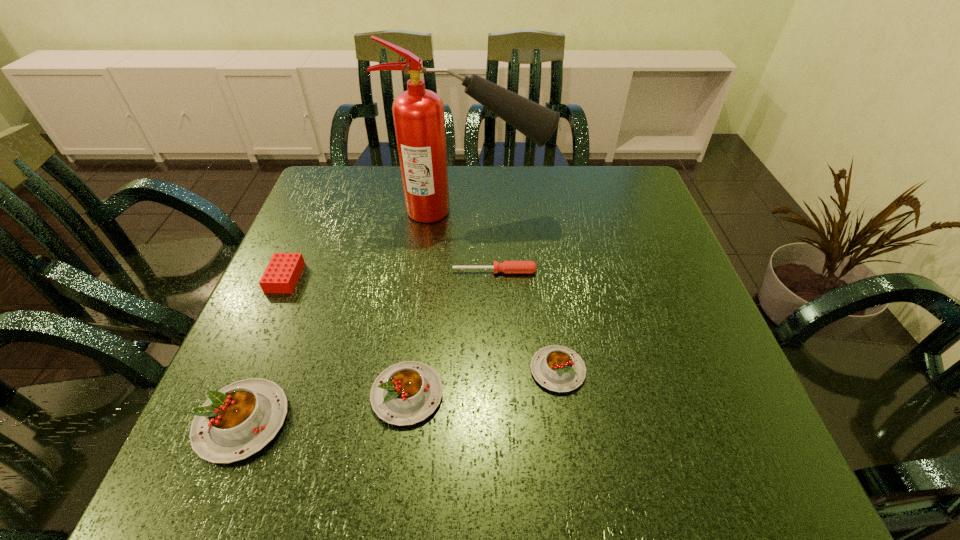
Image resolution: width=960 pixels, height=540 pixels. In the image, there is a desktop. Identify the location of vacant space at the near edge. (325, 417).

The height and width of the screenshot is (540, 960). In order to click on blank space at the left edge of the desktop in this screenshot , I will do [275, 301].

Image resolution: width=960 pixels, height=540 pixels. In the image, there is a desktop. What are the coordinates of `free region at the right edge` in the screenshot? It's located at (629, 255).

In the image, there is a desktop. In order to click on vacant space at the far left corner in this screenshot , I will do `click(362, 167)`.

Locate an element on the screen. The height and width of the screenshot is (540, 960). free region at the far right corner of the desktop is located at coordinates (610, 188).

You are a GUI agent. You are given a task and a screenshot of the screen. Output one action in this format:
    pyautogui.click(x=<x>, y=<y>)
    Task: Click on the empty space that is in between the shortest object and the second tallest pudding
    
    Given the screenshot: What is the action you would take?
    pyautogui.click(x=451, y=333)

Locate an element on the screen. free space between the shortest pudding and the second pudding from left to right is located at coordinates (483, 382).

Identify the location of free space that is in between the second pudding from right to left and the tallest pudding. [x=324, y=408].

The width and height of the screenshot is (960, 540). In order to click on free spot between the tallest pudding and the third tallest object in this screenshot , I will do `click(324, 408)`.

The height and width of the screenshot is (540, 960). In order to click on empty location between the second pudding from left to right and the Lego in this screenshot , I will do `click(347, 336)`.